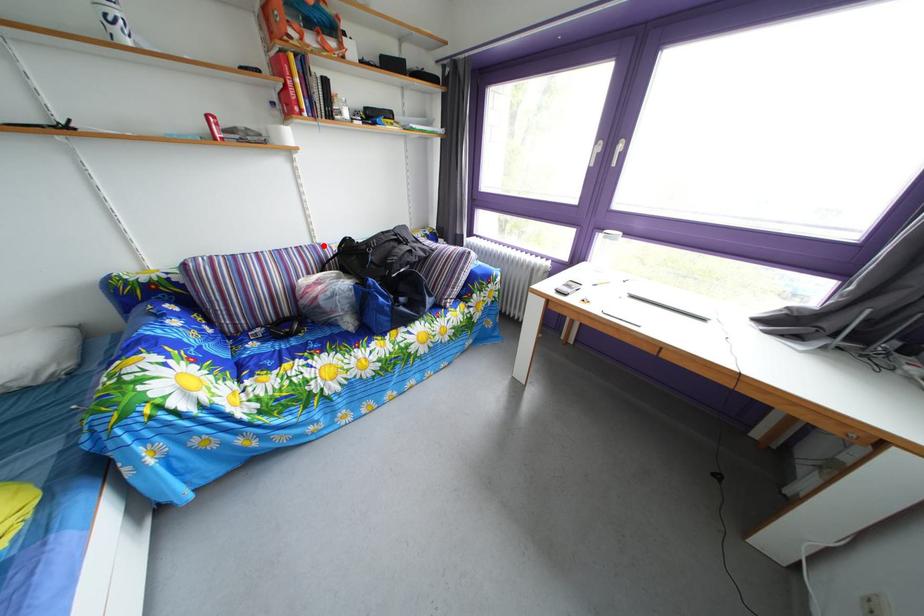
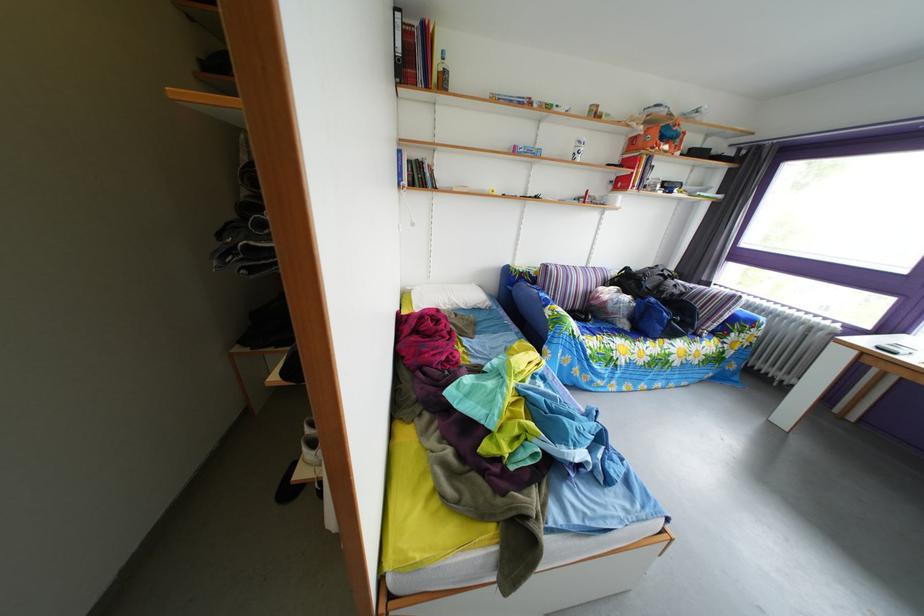
The point at the highlighted location is marked in the first image. Where is the corresponding point in the second image?

(599, 270)